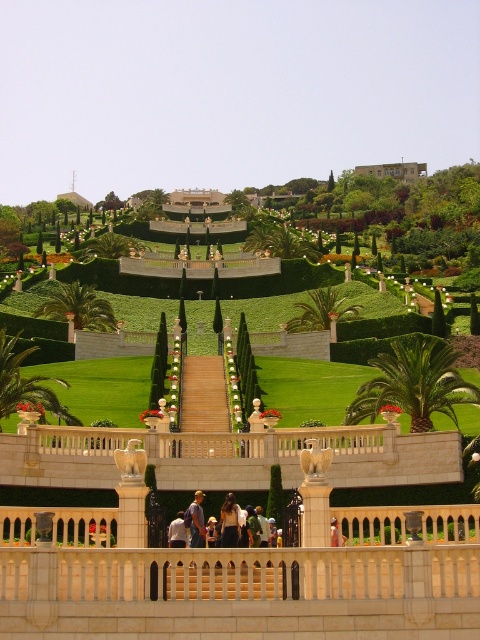
Which of these two, wooden stairs at center or beige stone building at upper center, stands taller?

beige stone building at upper center is taller.

Does wooden stairs at center have a lesser width compared to beige stone building at upper center?

Yes, wooden stairs at center is thinner than beige stone building at upper center.

This screenshot has width=480, height=640. What do you see at coordinates (224, 580) in the screenshot? I see `wooden stairs at center` at bounding box center [224, 580].

This screenshot has width=480, height=640. In order to click on wooden stairs at center in this screenshot , I will do `click(224, 580)`.

Looking at this image, can you confirm if light beige stone stairs at center is positioned above beige stone building at upper center?

Incorrect, light beige stone stairs at center is not positioned above beige stone building at upper center.

Does point (219, 401) lie in front of point (408, 170)?

That is True.

Describe the element at coordinates (204, 394) in the screenshot. This screenshot has width=480, height=640. I see `light beige stone stairs at center` at that location.

I want to click on light beige stone stairs at center, so click(204, 394).

Does wooden stairs at center appear on the right side of light beige stone stairs at center?

Yes, wooden stairs at center is to the right of light beige stone stairs at center.

Does point (203, 566) lie in front of point (184, 400)?

Yes, it is.

Which is behind, point (215, 580) or point (204, 360)?

The point (204, 360) is behind.

You are a GUI agent. You are given a task and a screenshot of the screen. Output one action in this format:
    pyautogui.click(x=<x>, y=<y>)
    Task: Click on the wooden stairs at center
    Image resolution: width=480 pixels, height=640 pixels.
    Given the screenshot: What is the action you would take?
    pyautogui.click(x=224, y=580)